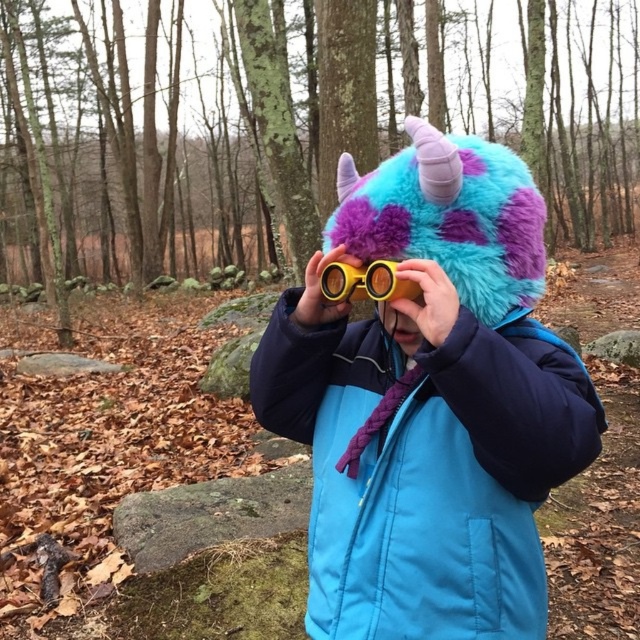
Question: Is blue quilted jacket at center smaller than yellow plastic goggles at center?

Choices:
 (A) no
 (B) yes

Answer: (A)

Question: Can you confirm if blue quilted jacket at center is bigger than yellow plastic goggles at center?

Choices:
 (A) yes
 (B) no

Answer: (A)

Question: Which point is closer to the camera?

Choices:
 (A) (323, 285)
 (B) (324, 580)

Answer: (A)

Question: Can you confirm if blue quilted jacket at center is wider than yellow plastic goggles at center?

Choices:
 (A) yes
 (B) no

Answer: (A)